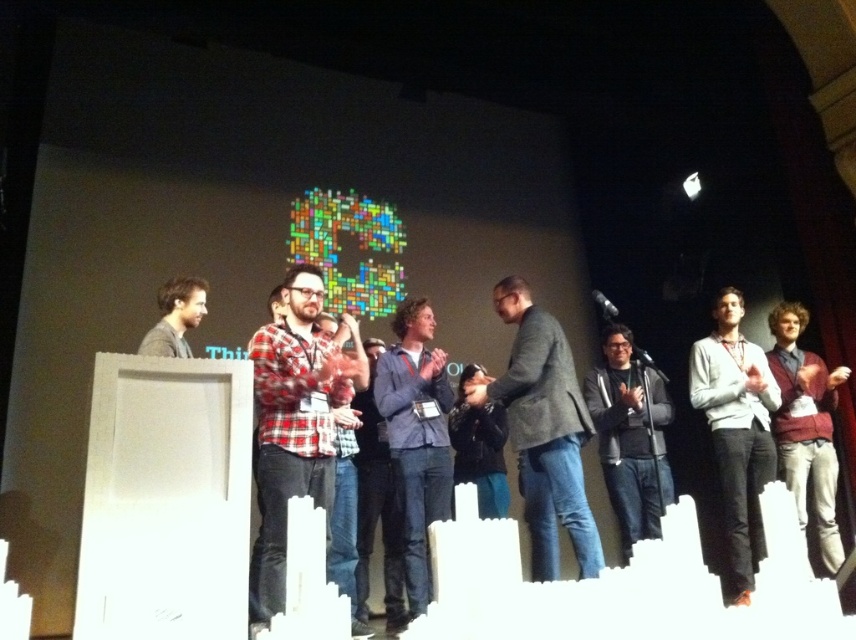
You are an event organizer trying to determine the best way to arrange the stage for the next speaker. Given the plaid flannel shirt at center and blue denim jeans at center, which item should be placed higher to ensure visibility from the audience?

The plaid flavel shirt at center is not as tall as blue denim jeans at center, so to ensure visibility from the audience, the blue denim jeans at center should be placed higher since it is taller than the plaid flannel shirt at center.

Looking at this image, you are an attendee seated in the audience looking at the stage. There are two points marked on the stage, point (x=512, y=316) and point (x=739, y=493). Which point is closer to you?

Point (x=512, y=316) is closer to the viewer than point (x=739, y=493).

You are a costume designer preparing for a performance. You need to ensure that the plaid flannel shirt at center and the blue denim jeans at center are positioned correctly on the mannequin. According to the provided description, what is the minimum distance you should maintain between them?

The plaid flannel shirt at center and blue denim jeans at center should be kept at least 26.69 inches apart from each other to match the described positioning.